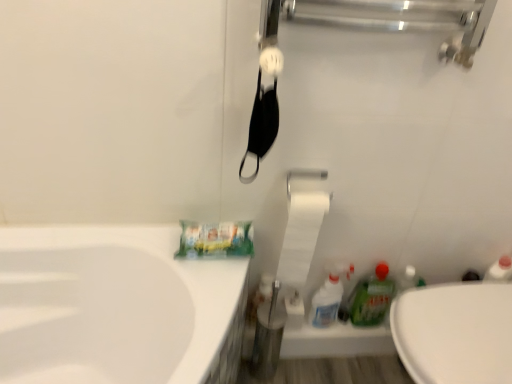
Question: Would you say green glossy bottle at lower right, placed as the 2th cleaning product when sorted from left to right, is inside or outside white glossy spray bottle at lower right, the second cleaning product viewed from the right?

Choices:
 (A) inside
 (B) outside

Answer: (B)

Question: Relative to white glossy spray bottle at lower right, placed as the first cleaning product when sorted from left to right, is green glossy bottle at lower right, the 1th cleaning product in the right-to-left sequence, in front or behind?

Choices:
 (A) behind
 (B) front

Answer: (A)

Question: Which object is positioned farthest from the white matte toilet paper at center?

Choices:
 (A) white glossy towel bar at upper center
 (B) white glossy toilet at lower right
 (C) green glossy bottle at lower right, the 1th cleaning product in the right-to-left sequence
 (D) white glossy spray bottle at lower right, placed as the first cleaning product when sorted from left to right

Answer: (B)

Question: Which object is the closest to the white glossy toilet at lower right?

Choices:
 (A) white glossy towel bar at upper center
 (B) green glossy bottle at lower right, placed as the 2th cleaning product when sorted from left to right
 (C) white matte toilet paper at center
 (D) white glossy spray bottle at lower right, the second cleaning product viewed from the right

Answer: (B)